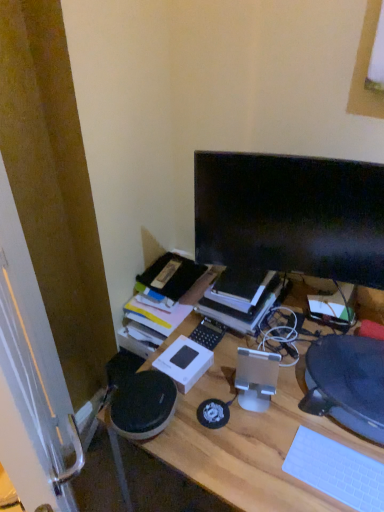
Find the location of a particular element. vacant space to the left of white matte keyboard at lower right is located at coordinates (264, 465).